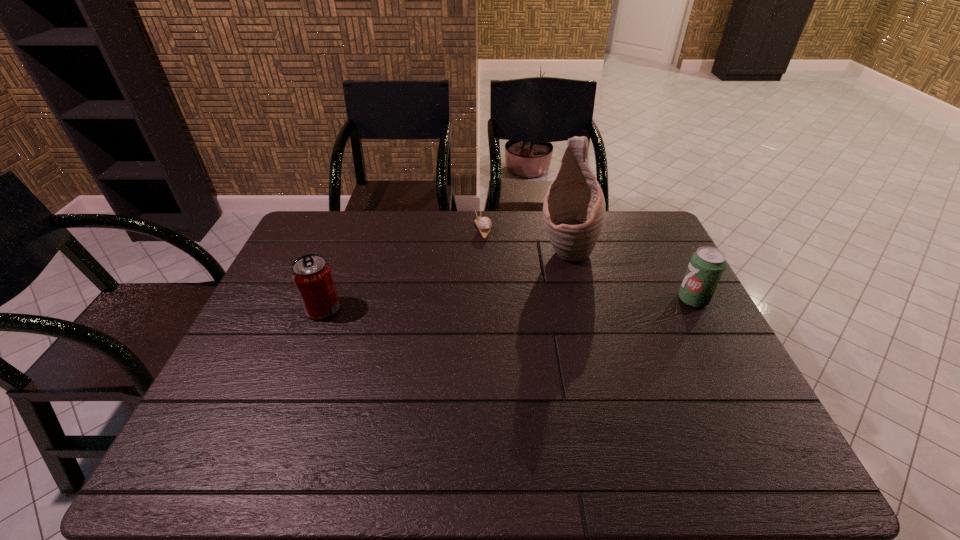
Find the location of a particular element. This screenshot has height=540, width=960. free space on the desktop that is between the leftmost object and the right soda and is positioned at the spout of the tallest object is located at coordinates pos(560,303).

Locate an element on the screen. The width and height of the screenshot is (960, 540). vacant space on the desktop that is between the leftmost object and the right soda and is positioned on the shell of the third object from right to left is located at coordinates (525, 303).